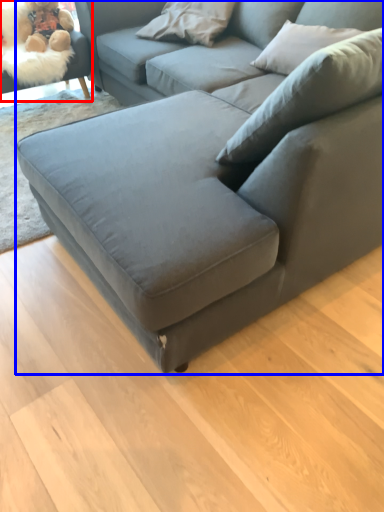
Question: Which point is closer to the camera, swivel chair (highlighted by a red box) or studio couch (highlighted by a blue box)?

Choices:
 (A) swivel chair
 (B) studio couch

Answer: (B)